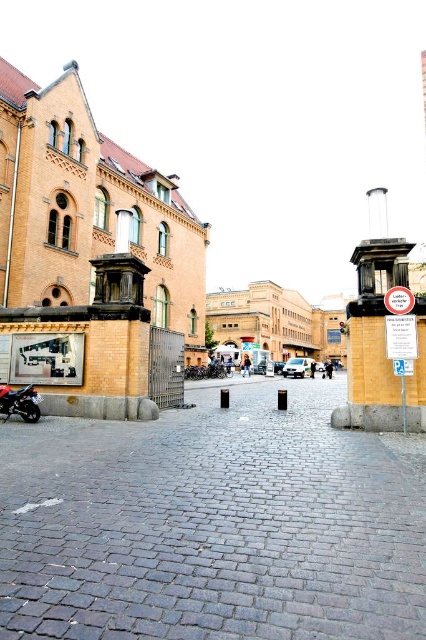
Question: Is gray cobblestone pavement at center positioned behind shiny red motorcycle at lower left?

Choices:
 (A) no
 (B) yes

Answer: (A)

Question: Can you confirm if gray cobblestone pavement at center is positioned above shiny red motorcycle at lower left?

Choices:
 (A) yes
 (B) no

Answer: (B)

Question: Which object appears closest to the camera in this image?

Choices:
 (A) gray cobblestone pavement at center
 (B) shiny red motorcycle at lower left

Answer: (A)

Question: Is gray cobblestone pavement at center closer to the viewer compared to shiny red motorcycle at lower left?

Choices:
 (A) no
 (B) yes

Answer: (B)

Question: Among these objects, which one is farthest from the camera?

Choices:
 (A) gray cobblestone pavement at center
 (B) shiny red motorcycle at lower left

Answer: (B)